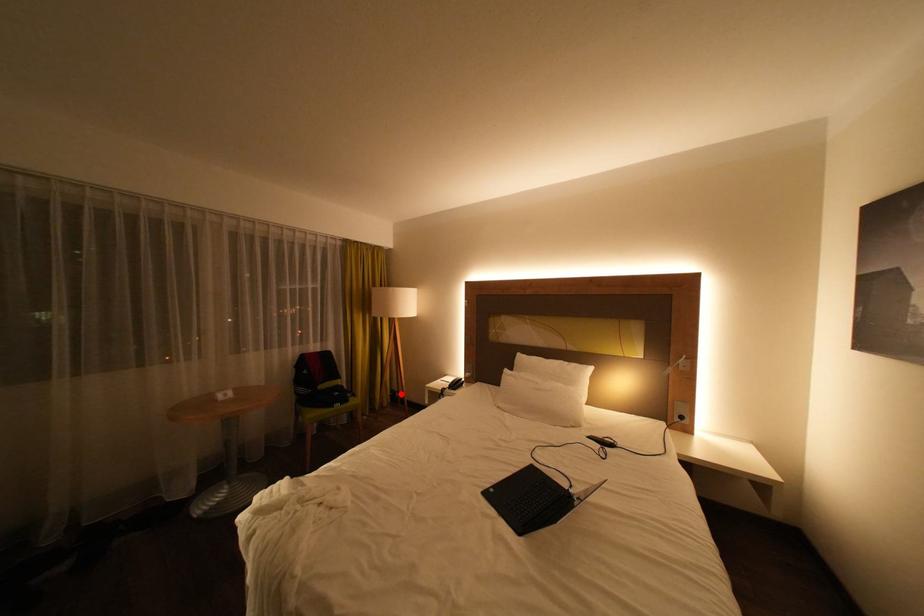
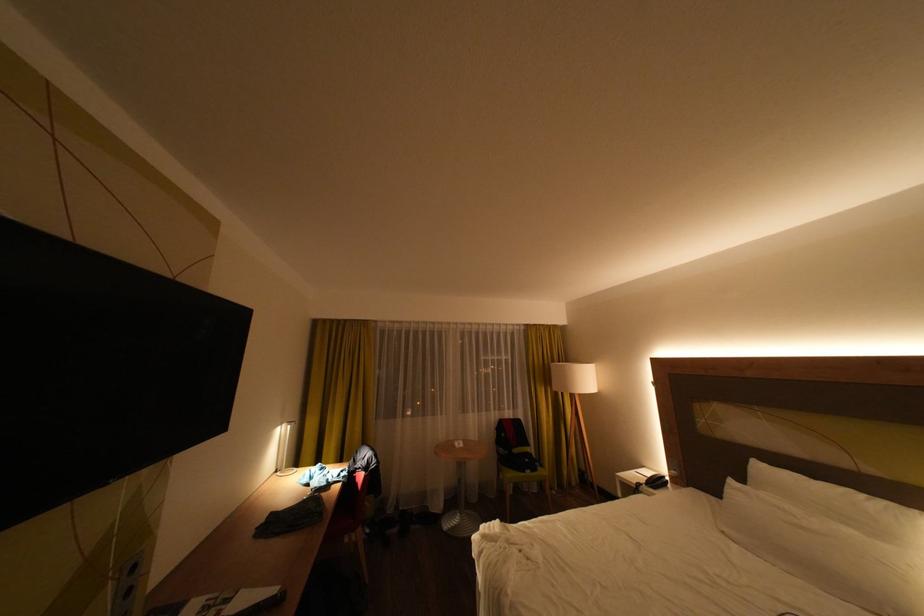
Question: I am providing you with two images of the same scene from different viewpoints. A red point is shown in image1. For the corresponding object point in image2, is it positioned nearer or farther from the camera?

Choices:
 (A) Nearer
 (B) Farther

Answer: (B)